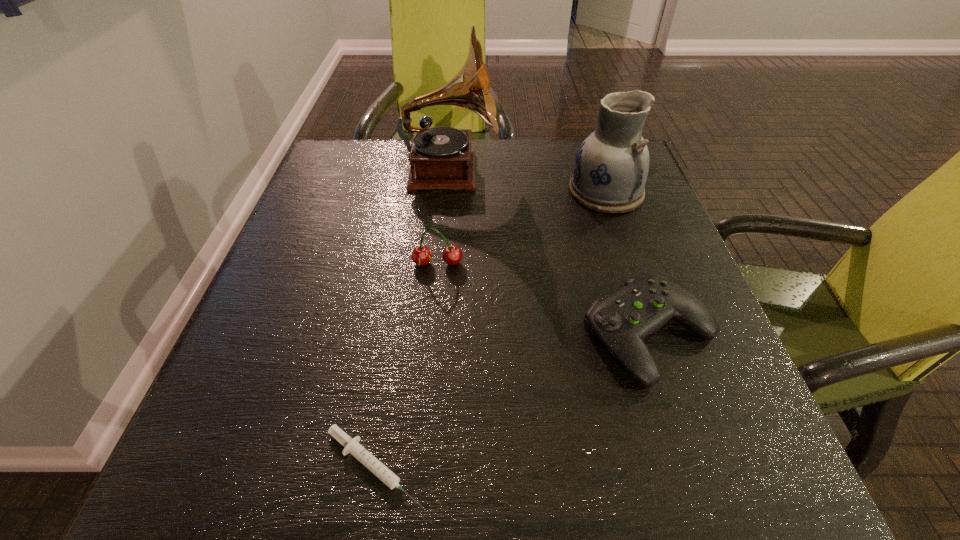
Where is `blank space located 0.270m with stems pointing upwards on the cherry`? blank space located 0.270m with stems pointing upwards on the cherry is located at coordinates (x=425, y=396).

This screenshot has height=540, width=960. I want to click on free space located on the back of the second shortest object, so click(x=605, y=199).

Locate an element on the screen. vacant area situated 0.260m on the right of the nearest object is located at coordinates (617, 467).

Find the location of `phonograph_record that is at the far edge`. phonograph_record that is at the far edge is located at coordinates (440, 157).

Where is `pottery located at the far edge`? pottery located at the far edge is located at coordinates (611, 167).

Identify the location of object that is at the near edge. The height and width of the screenshot is (540, 960). (352, 446).

Locate an element on the screen. pottery located at the right edge is located at coordinates (611, 167).

Locate an element on the screen. The width and height of the screenshot is (960, 540). control that is positioned at the right edge is located at coordinates (647, 302).

Locate an element on the screen. This screenshot has height=540, width=960. object that is at the far right corner is located at coordinates (611, 167).

At what (x,y) coordinates should I click in order to perform the action: click on vacant region at the far edge of the desktop. Please return your answer as a coordinate pair (x, y). Looking at the image, I should click on (509, 173).